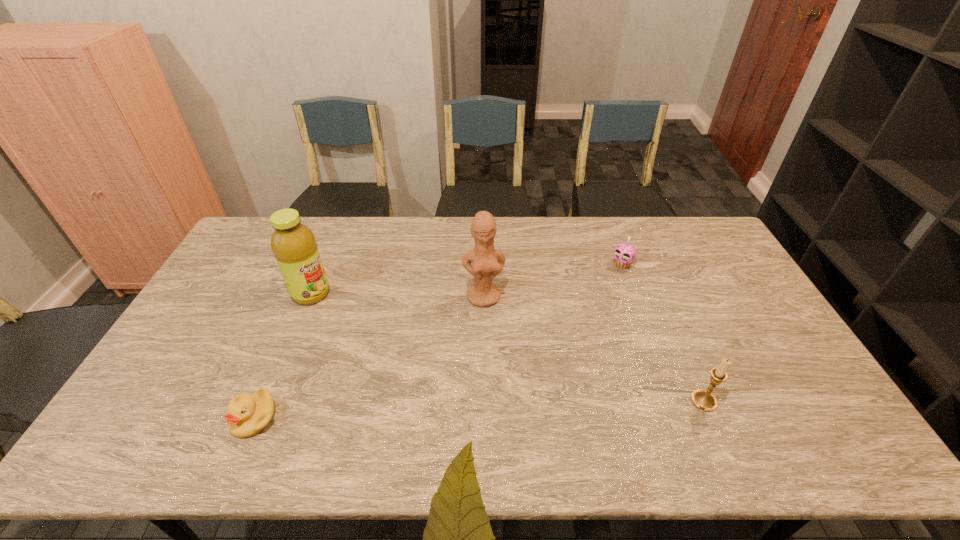
You are a GUI agent. You are given a task and a screenshot of the screen. Output one action in this format:
    pyautogui.click(x=<x>, y=<y>)
    Task: Click on the free space located 0.220m on the front-facing side of the figurine
    The height and width of the screenshot is (540, 960).
    Given the screenshot: What is the action you would take?
    pyautogui.click(x=496, y=367)

Locate an element on the screen. free space located 0.380m on the front label of the fruit juice is located at coordinates (414, 358).

Where is `vacant area situated 0.310m on the front label of the fruit juice`? Image resolution: width=960 pixels, height=540 pixels. vacant area situated 0.310m on the front label of the fruit juice is located at coordinates (396, 347).

You are a GUI agent. You are given a task and a screenshot of the screen. Output one action in this format:
    pyautogui.click(x=<x>, y=<y>)
    Task: Click on the free space located on the front label of the fruit juice
    
    Given the screenshot: What is the action you would take?
    pyautogui.click(x=378, y=336)

Locate an element on the screen. This screenshot has width=960, height=540. vacant space located 0.100m on the face of the cupcake is located at coordinates (602, 286).

Identify the location of vacant space situated 0.160m on the face of the cupcake. The width and height of the screenshot is (960, 540). point(593,295).

Identify the location of free space located 0.200m on the face of the cupcake. This screenshot has height=540, width=960. (587, 302).

The image size is (960, 540). I want to click on duckling located at the near edge, so click(247, 415).

I want to click on candle holder that is at the near edge, so click(702, 399).

In the image, there is a desktop. Identify the location of free space at the far edge. This screenshot has height=540, width=960. (540, 234).